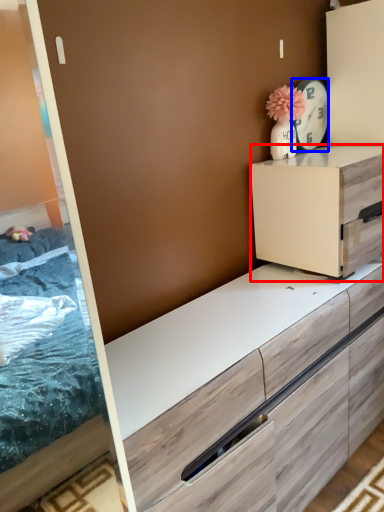
Question: Which of the following is the farthest to the observer, chest of drawers (highlighted by a red box) or appliance (highlighted by a blue box)?

Choices:
 (A) chest of drawers
 (B) appliance

Answer: (B)